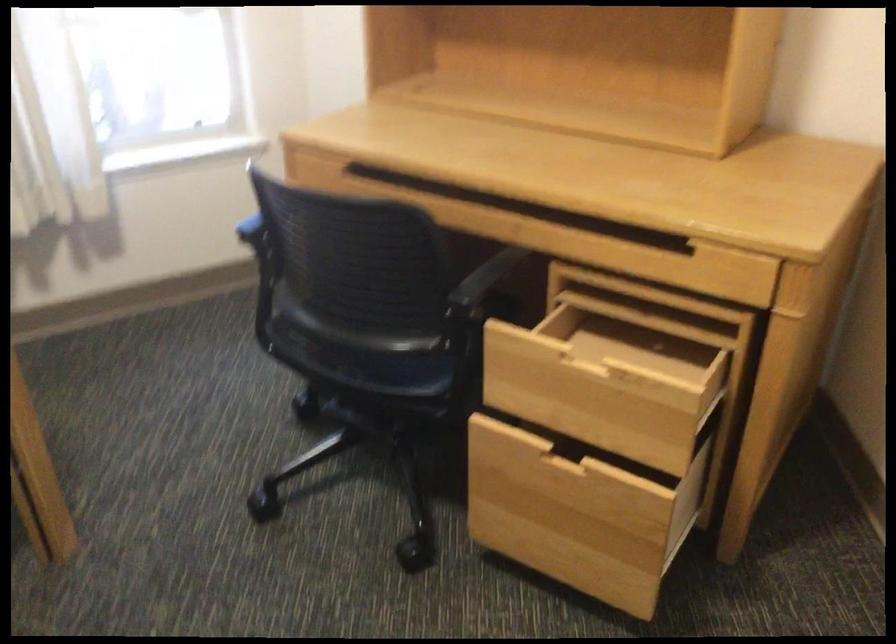
Find where to sit the chair sitting surface. Please return your answer as a coordinate pair (x, y).

(359, 355)